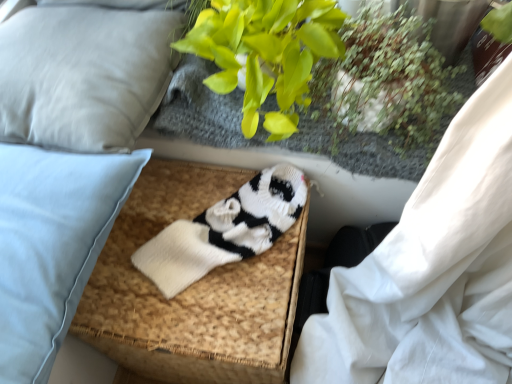
Question: Does light gray fabric pillow at upper left, the second pillow from the bottom, have a larger size compared to white knitted footrest at center?

Choices:
 (A) yes
 (B) no

Answer: (B)

Question: Does light gray fabric pillow at upper left, acting as the 1th pillow starting from the top, have a lesser height compared to white knitted footrest at center?

Choices:
 (A) no
 (B) yes

Answer: (B)

Question: Is light gray fabric pillow at upper left, acting as the 1th pillow starting from the top, closer to camera compared to white knitted footrest at center?

Choices:
 (A) no
 (B) yes

Answer: (A)

Question: Considering the relative sizes of light gray fabric pillow at upper left, the second pillow from the bottom, and white knitted footrest at center in the image provided, is light gray fabric pillow at upper left, the second pillow from the bottom, thinner than white knitted footrest at center?

Choices:
 (A) yes
 (B) no

Answer: (A)

Question: Is light gray fabric pillow at upper left, the second pillow from the bottom, not inside white knitted footrest at center?

Choices:
 (A) yes
 (B) no

Answer: (A)

Question: Is green leafy plant at upper center to the left or to the right of green leafy plant at upper right in the image?

Choices:
 (A) left
 (B) right

Answer: (A)

Question: From a real-world perspective, relative to green leafy plant at upper right, is green leafy plant at upper center vertically above or below?

Choices:
 (A) above
 (B) below

Answer: (A)

Question: Is green leafy plant at upper center inside or outside of green leafy plant at upper right?

Choices:
 (A) outside
 (B) inside

Answer: (A)

Question: Looking at their shapes, would you say green leafy plant at upper center is wider or thinner than green leafy plant at upper right?

Choices:
 (A) thin
 (B) wide

Answer: (B)

Question: Is point (417, 77) positioned closer to the camera than point (46, 254)?

Choices:
 (A) farther
 (B) closer

Answer: (A)

Question: Based on their sizes in the image, would you say green leafy plant at upper center is bigger or smaller than light blue fabric pillow at left, positioned as the 1th pillow in bottom-to-top order?

Choices:
 (A) small
 (B) big

Answer: (B)

Question: From the image's perspective, relative to light blue fabric pillow at left, which is counted as the 2th pillow, starting from the top, is green leafy plant at upper center above or below?

Choices:
 (A) below
 (B) above

Answer: (B)

Question: Is green leafy plant at upper center taller or shorter than light blue fabric pillow at left, positioned as the 1th pillow in bottom-to-top order?

Choices:
 (A) short
 (B) tall

Answer: (B)

Question: Considering their positions, is white knitted footrest at center located in front of or behind light gray fabric pillow at upper left, acting as the 1th pillow starting from the top?

Choices:
 (A) behind
 (B) front

Answer: (B)

Question: Looking at their shapes, would you say white knitted footrest at center is wider or thinner than light gray fabric pillow at upper left, the second pillow from the bottom?

Choices:
 (A) thin
 (B) wide

Answer: (B)